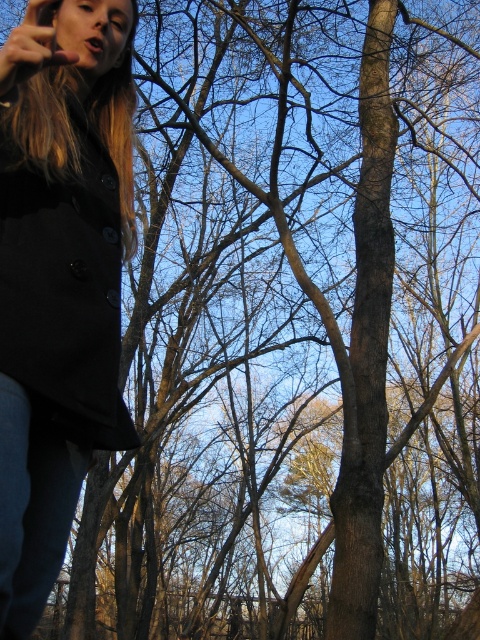
You are standing in the forest and see the black matte coat at left. If you walk directly towards the center of the image, will the coat remain on your left side?

Yes, the black matte coat at left is located at point [63,280], which is on the left side of the image. Walking towards the center would keep the coat on your left side as you move forward.

You are a hiker who wants to know if your backpack can fit between the black matte coat at left and the jeans at lower left. The backpack is 1.2 meters wide. Can it fit?

The black matte coat at left is wider than the jeans at lower left. The width of the coat is larger, so the backpack might not fit between them if the space between them is narrower than 1.2 meters. However, without knowing the exact distance between the two objects, it is impossible to determine for sure.